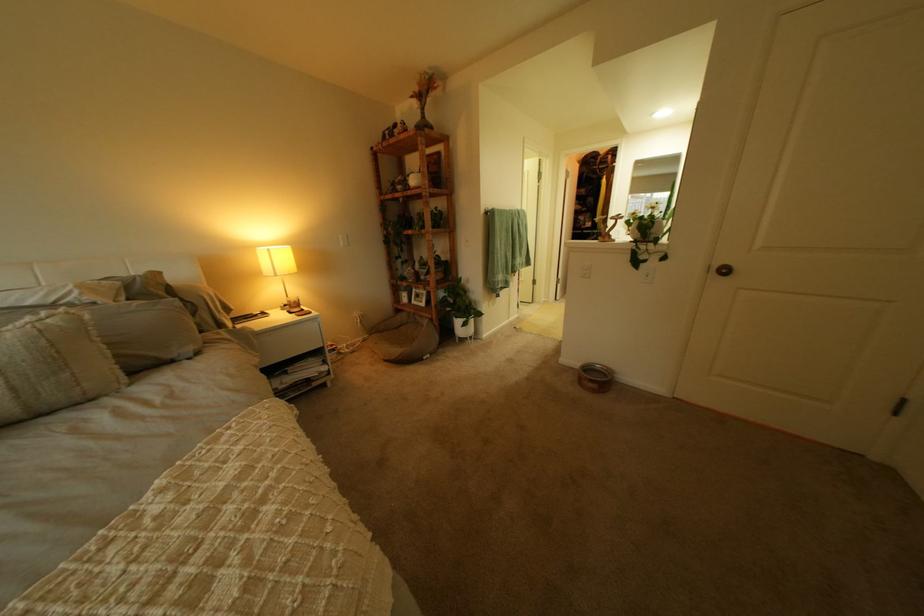
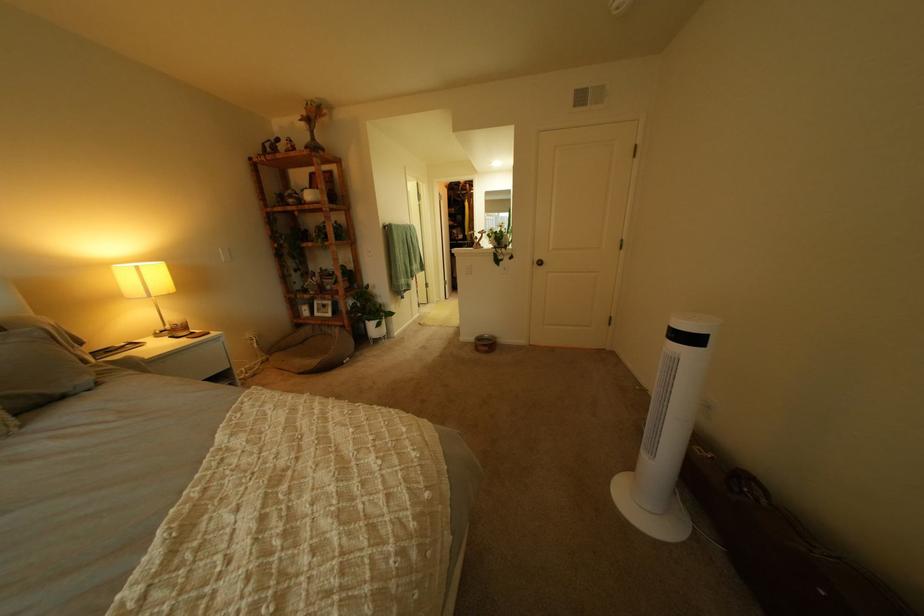
Where in the second image is the point corresponding to point 213,355 from the first image?

(115, 385)